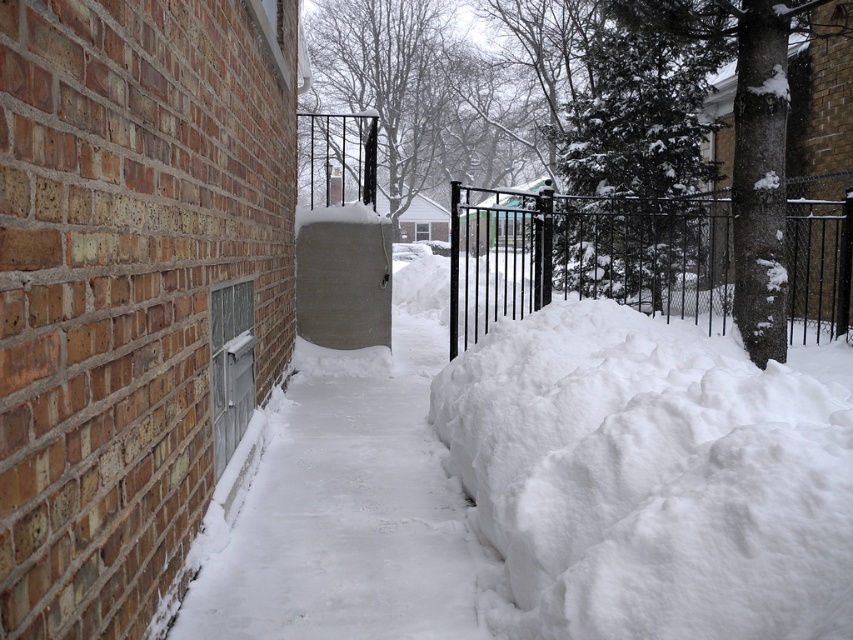
Question: Which object appears farthest from the camera in this image?

Choices:
 (A) white snow at center
 (B) black wrought iron fence at center

Answer: (B)

Question: Considering the relative positions of white fluffy snow at right and white snow at center in the image provided, where is white fluffy snow at right located with respect to white snow at center?

Choices:
 (A) below
 (B) above

Answer: (A)

Question: Which of the following is the closest to the observer?

Choices:
 (A) white snow at center
 (B) black wrought iron fence at center

Answer: (A)

Question: Can you confirm if white snow at center is positioned above black wrought iron fence at center?

Choices:
 (A) no
 (B) yes

Answer: (A)

Question: Which point appears farthest from the camera in this image?

Choices:
 (A) (270, 547)
 (B) (485, 388)
 (C) (729, 301)

Answer: (C)

Question: Is white snow at center above black wrought iron fence at center?

Choices:
 (A) no
 (B) yes

Answer: (A)